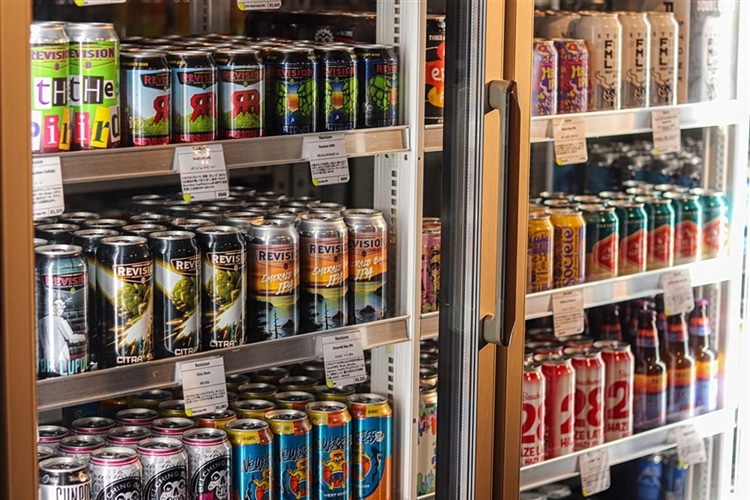
The image size is (750, 500). In order to click on all cans in front row of second shelf of the left case in this screenshot , I will do `click(368, 268)`, `click(331, 285)`, `click(285, 309)`, `click(230, 320)`, `click(189, 325)`, `click(134, 327)`, `click(78, 334)`.